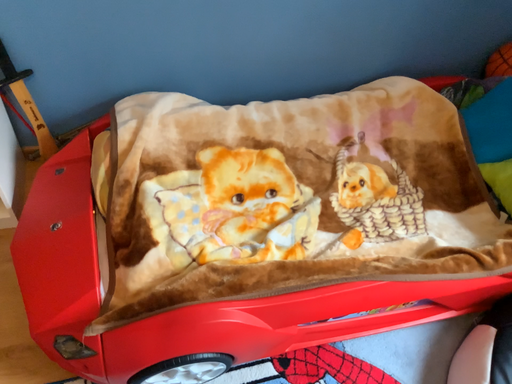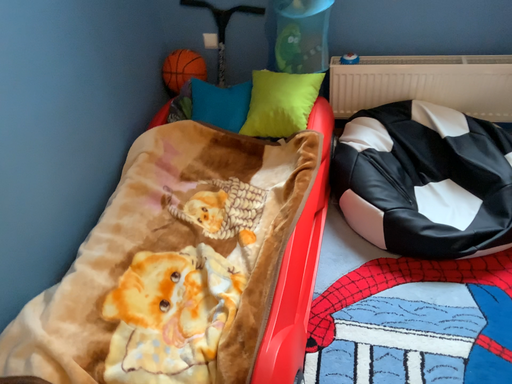
Question: How did the camera likely rotate when shooting the video?

Choices:
 (A) rotated right
 (B) rotated left

Answer: (A)